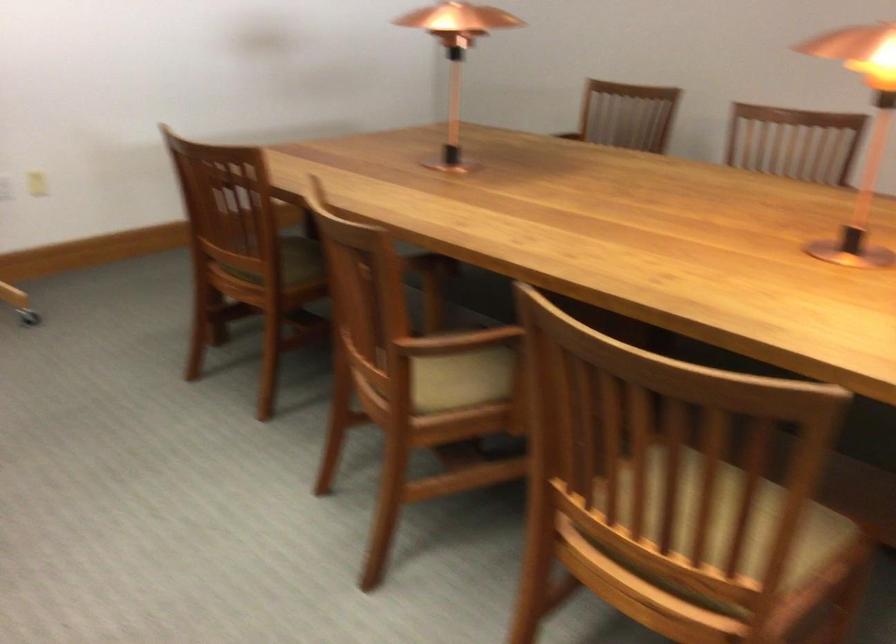
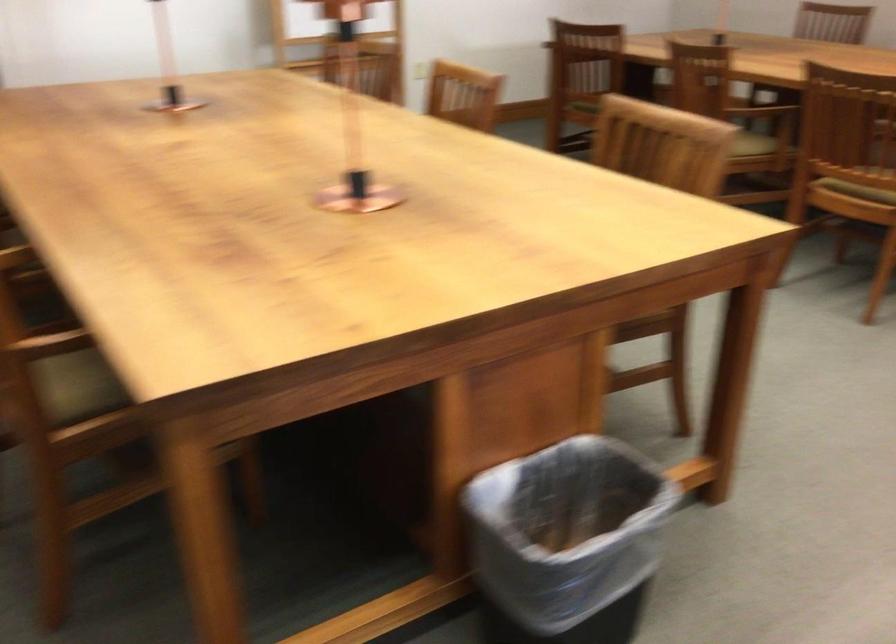
Question: I am providing you with two images of the same scene from different viewpoints. Which of the following objects are not visible in image2?

Choices:
 (A) wooden chair armrest
 (B) black trash can
 (C) white nameplate holder
 (D) green chair sitting surface

Answer: (A)